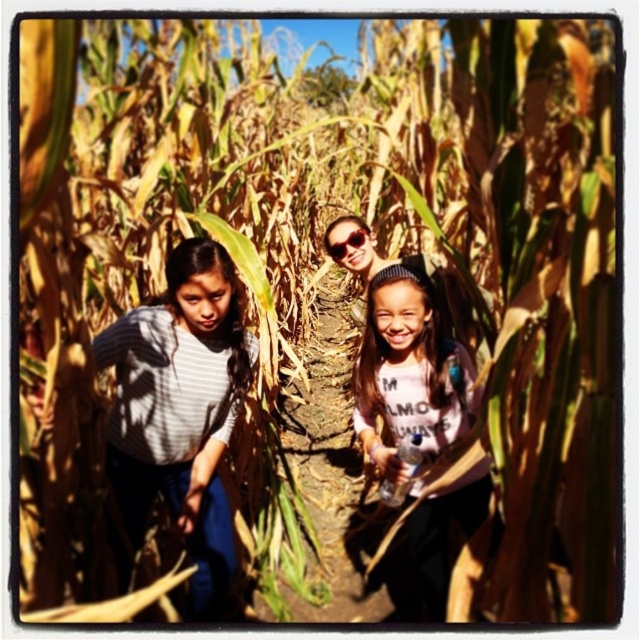
You are a photographer standing at the edge of the cornfield. You want to take a photo of the gray striped shirt at left and the sunglasses at center. If your camera has a maximum focus range of 5 feet, will both subjects be in focus?

The gray striped shirt at left and sunglasses at center are 5.48 feet apart from each other, which exceeds the camera maximum focus range of 5 feet. Therefore, both subjects may not be in focus simultaneously.

You are a photographer trying to capture a clear shot of both the white cotton shirt at center and the sunglasses at center in the cornfield. Since the corn plants are tall and dense, you need to ensure both objects are visible. Which object might be easier to see in the photo and why?

The white cotton shirt at center is larger in size than the sunglasses at center, so it might be easier to see in the photo due to its bigger size compared to the sunglasses.

Based on the photo, you are a photographer standing at the edge of the cornfield. You want to take a photo of the gray striped shirt at left and the white cotton shirt at center so that both are in focus. Given that your camera has a depth of field that can cover 35 inches, will both shirts be in focus?

The gray striped shirt at left and white cotton shirt at center are 36.03 inches apart. Since the camera can only cover 35 inches, the distance between them exceeds the depth of field, so both shirts cannot be in focus simultaneously.